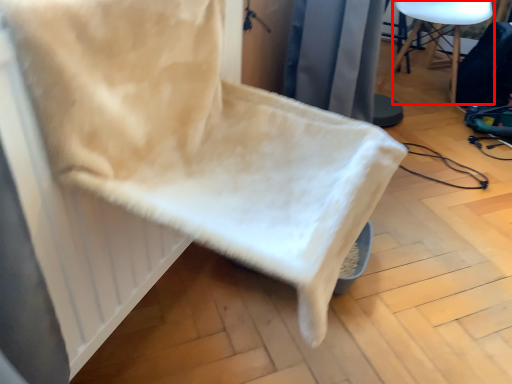
Question: From the image, what is the correct spatial relationship of furniture (annotated by the red box) in relation to chair?

Choices:
 (A) right
 (B) left

Answer: (A)